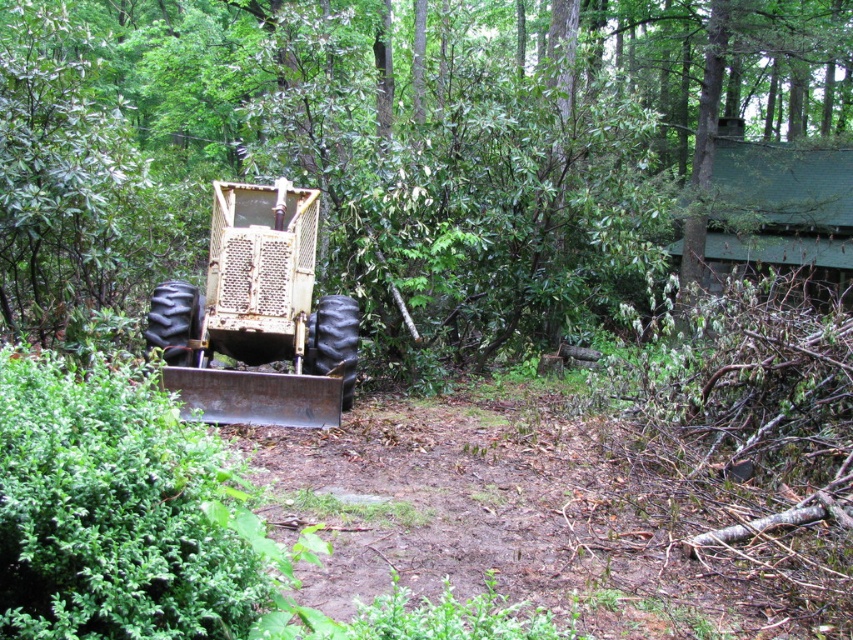
You are a hiker who wants to take a photo of the rusty metal tractor at center without the green leafy tree at center blocking the view. Is there a position where you can stand to achieve this?

The green leafy tree at center is much taller than the rusty metal tractor at center, so if you stand behind the tree, you might be able to position yourself where the tree doesn

You are standing at point (267,401) and want to walk to the yellow tractor parked near point (16,38). Which direction should you move relative to your current position?

You should move forward because point (16,38) is behind point (267,401), meaning the tractor is in front of your current position.